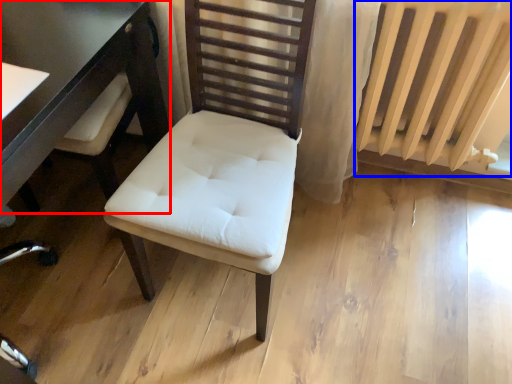
Question: Which point is closer to the camera, table (highlighted by a red box) or radiator (highlighted by a blue box)?

Choices:
 (A) table
 (B) radiator

Answer: (A)